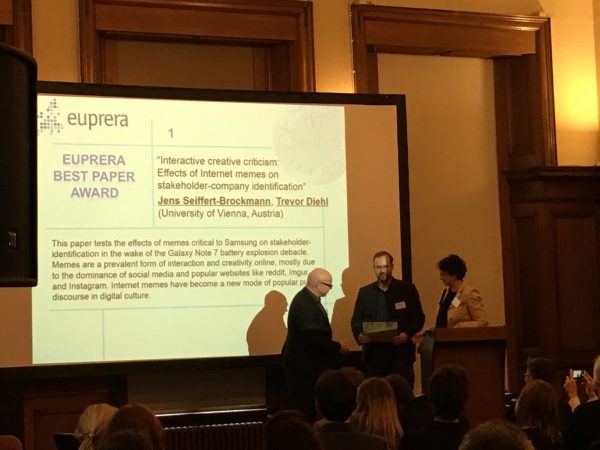
The height and width of the screenshot is (450, 600). In order to click on yellow wall in this screenshot , I will do `click(336, 63)`.